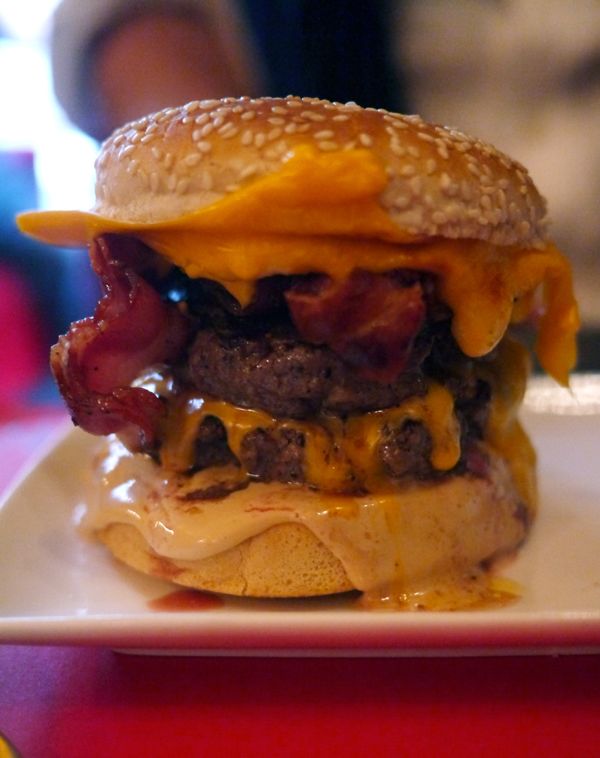
Image resolution: width=600 pixels, height=758 pixels. In order to click on table in this screenshot , I will do `click(287, 724)`.